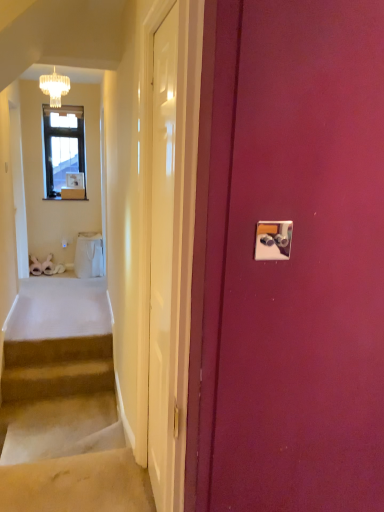
Describe the element at coordinates (161, 246) in the screenshot. The image size is (384, 512). I see `white glossy door at center, placed as the 2th door when sorted from left to right` at that location.

I want to click on white glossy door at center, the 1th door when ordered from right to left, so click(x=161, y=246).

The height and width of the screenshot is (512, 384). Identify the location of white glossy box at upper left. (72, 193).

The image size is (384, 512). Describe the element at coordinates (65, 431) in the screenshot. I see `beige carpeted stairs at lower left, which ranks as the second stairs in top-to-bottom order` at that location.

Describe the element at coordinates (171, 238) in the screenshot. I see `white glossy door at center, the 1th door positioned from the left` at that location.

The image size is (384, 512). What are the coordinates of `crystal glass chandelier at upper left` in the screenshot? It's located at (54, 87).

From a real-world perspective, which object stands above the other?

white glossy box at upper left is physically above.

Which of these two, carpeted stairs at lower left, which ranks as the first stairs in top-to-bottom order, or white glossy box at upper left, is wider?

With larger width is carpeted stairs at lower left, which ranks as the first stairs in top-to-bottom order.

From the picture: Is white glossy box at upper left surrounded by carpeted stairs at lower left, marked as the second stairs in a bottom-to-top arrangement?

Definitely not — white glossy box at upper left is not inside carpeted stairs at lower left, marked as the second stairs in a bottom-to-top arrangement.

Looking at their sizes, would you say white glossy door at center, the 1th door when ordered from right to left, is wider or thinner than carpeted stairs at lower left, which ranks as the first stairs in top-to-bottom order?

Clearly, white glossy door at center, the 1th door when ordered from right to left, has less width compared to carpeted stairs at lower left, which ranks as the first stairs in top-to-bottom order.

Is white glossy door at center, placed as the 2th door when sorted from left to right, at the left side of carpeted stairs at lower left, marked as the second stairs in a bottom-to-top arrangement?

In fact, white glossy door at center, placed as the 2th door when sorted from left to right, is to the right of carpeted stairs at lower left, marked as the second stairs in a bottom-to-top arrangement.

Would you say white glossy door at center, placed as the 2th door when sorted from left to right, contains carpeted stairs at lower left, which ranks as the first stairs in top-to-bottom order?

Definitely not — carpeted stairs at lower left, which ranks as the first stairs in top-to-bottom order, is not inside white glossy door at center, placed as the 2th door when sorted from left to right.

Can you confirm if crystal glass chandelier at upper left is bigger than white glossy door at center, the 1th door positioned from the left?

No.

Looking at this image, is crystal glass chandelier at upper left oriented away from white glossy door at center, the 1th door positioned from the left?

No.

Based on the photo, considering the relative positions of crystal glass chandelier at upper left and white glossy door at center, the 1th door positioned from the left, in the image provided, is crystal glass chandelier at upper left to the left or to the right of white glossy door at center, the 1th door positioned from the left,?

crystal glass chandelier at upper left is to the left of white glossy door at center, the 1th door positioned from the left.

Is metallic silver light switch at upper right oriented away from white glossy box at upper left?

Yes, metallic silver light switch at upper right is facing away from white glossy box at upper left.

Does point (282, 234) come closer to viewer compared to point (70, 190)?

Yes, point (282, 234) is in front of point (70, 190).

From the picture: Which object is wider, metallic silver light switch at upper right or white glossy box at upper left?

With larger width is white glossy box at upper left.

Is metallic silver light switch at upper right spatially inside white glossy box at upper left, or outside of it?

The correct answer is: outside.

Is white glossy box at upper left at the back of crystal glass chandelier at upper left?

crystal glass chandelier at upper left does not have its back to white glossy box at upper left.

Between crystal glass chandelier at upper left and white glossy box at upper left, which one appears on the left side from the viewer's perspective?

From the viewer's perspective, white glossy box at upper left appears more on the left side.

From a real-world perspective, does crystal glass chandelier at upper left sit lower than white glossy box at upper left?

Actually, crystal glass chandelier at upper left is physically above white glossy box at upper left in the real world.

Between crystal glass chandelier at upper left and white glossy box at upper left, which one has larger width?

crystal glass chandelier at upper left is wider.

Is carpeted stairs at lower left, marked as the second stairs in a bottom-to-top arrangement, to the right of metallic silver light switch at upper right from the viewer's perspective?

No.

Is carpeted stairs at lower left, marked as the second stairs in a bottom-to-top arrangement, closer to the viewer compared to metallic silver light switch at upper right?

No, carpeted stairs at lower left, marked as the second stairs in a bottom-to-top arrangement, is behind metallic silver light switch at upper right.

Is carpeted stairs at lower left, which ranks as the first stairs in top-to-bottom order, directly adjacent to metallic silver light switch at upper right?

No, carpeted stairs at lower left, which ranks as the first stairs in top-to-bottom order, is not beside metallic silver light switch at upper right.

Which is further, (65, 468) or (65, 192)?

The point (65, 192) is more distant.

Would you say beige carpeted stairs at lower left, which ranks as the second stairs in top-to-bottom order, is outside white glossy box at upper left?

Absolutely, beige carpeted stairs at lower left, which ranks as the second stairs in top-to-bottom order, is external to white glossy box at upper left.

From the image's perspective, between beige carpeted stairs at lower left, which ranks as the second stairs in top-to-bottom order, and white glossy box at upper left, who is located below?

beige carpeted stairs at lower left, which ranks as the second stairs in top-to-bottom order, from the image's perspective.

Is beige carpeted stairs at lower left, which is counted as the first stairs, starting from the bottom, further to the viewer compared to white glossy box at upper left?

That is False.

Which stairs is the 1st one when counting from the right side of the white glossy box at upper left? Please provide its 2D coordinates.

[(57, 368)]

This screenshot has height=512, width=384. I want to click on the 1st stairs below the white glossy door at center, the 1th door when ordered from right to left (from the image's perspective), so click(x=57, y=368).

From the image, which object appears to be farther from metallic silver light switch at upper right, white glossy door at center, placed as the 2th door when sorted from left to right, or carpeted stairs at lower left, which ranks as the first stairs in top-to-bottom order?

Based on the image, carpeted stairs at lower left, which ranks as the first stairs in top-to-bottom order, appears to be further to metallic silver light switch at upper right.

Estimate the real-world distances between objects in this image. Which object is closer to white glossy door at center, the 1th door positioned from the left, carpeted stairs at lower left, which ranks as the first stairs in top-to-bottom order, or white glossy box at upper left?

carpeted stairs at lower left, which ranks as the first stairs in top-to-bottom order, is positioned closer to the anchor white glossy door at center, the 1th door positioned from the left.

Estimate the real-world distances between objects in this image. Which object is further from white glossy door at center, the 1th door when ordered from right to left, metallic silver light switch at upper right or white glossy door at center, acting as the second door starting from the right?

Based on the image, metallic silver light switch at upper right appears to be further to white glossy door at center, the 1th door when ordered from right to left.

Which object lies nearer to the anchor point metallic silver light switch at upper right, beige carpeted stairs at lower left, which ranks as the second stairs in top-to-bottom order, or white glossy door at center, the 1th door when ordered from right to left?

white glossy door at center, the 1th door when ordered from right to left, is positioned closer to the anchor metallic silver light switch at upper right.

Considering their positions, is metallic silver light switch at upper right positioned further to white glossy door at center, the 1th door positioned from the left, than crystal glass chandelier at upper left?

Among the two, crystal glass chandelier at upper left is located further to white glossy door at center, the 1th door positioned from the left.

Based on their spatial positions, is carpeted stairs at lower left, which ranks as the first stairs in top-to-bottom order, or white glossy box at upper left further from metallic silver light switch at upper right?

Based on the image, white glossy box at upper left appears to be further to metallic silver light switch at upper right.

Based on the photo, based on their spatial positions, is white glossy door at center, the 1th door when ordered from right to left, or white glossy box at upper left closer to beige carpeted stairs at lower left, which is counted as the first stairs, starting from the bottom?

The object closer to beige carpeted stairs at lower left, which is counted as the first stairs, starting from the bottom, is white glossy door at center, the 1th door when ordered from right to left.

From the image, which object appears to be farther from white glossy door at center, the 1th door when ordered from right to left, white glossy door at center, acting as the second door starting from the right, or crystal glass chandelier at upper left?

Among the two, crystal glass chandelier at upper left is located further to white glossy door at center, the 1th door when ordered from right to left.

This screenshot has width=384, height=512. What are the coordinates of `lamp between metallic silver light switch at upper right and white glossy box at upper left along the z-axis` in the screenshot? It's located at (54, 87).

The height and width of the screenshot is (512, 384). What are the coordinates of `stairs between white glossy door at center, placed as the 2th door when sorted from left to right, and carpeted stairs at lower left, which ranks as the first stairs in top-to-bottom order, in the front-back direction` in the screenshot? It's located at (65, 431).

Where is `door between white glossy door at center, acting as the second door starting from the right, and carpeted stairs at lower left, marked as the second stairs in a bottom-to-top arrangement, in the front-back direction`? door between white glossy door at center, acting as the second door starting from the right, and carpeted stairs at lower left, marked as the second stairs in a bottom-to-top arrangement, in the front-back direction is located at coordinates (161, 246).

Find the location of a particular element. light switch between crystal glass chandelier at upper left and beige carpeted stairs at lower left, which is counted as the first stairs, starting from the bottom, from top to bottom is located at coordinates (273, 240).